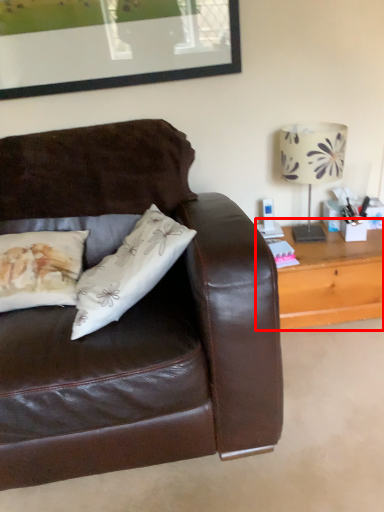
Question: From the image, what is the correct spatial relationship of table (annotated by the red box) in relation to table lamp?

Choices:
 (A) left
 (B) right

Answer: (B)